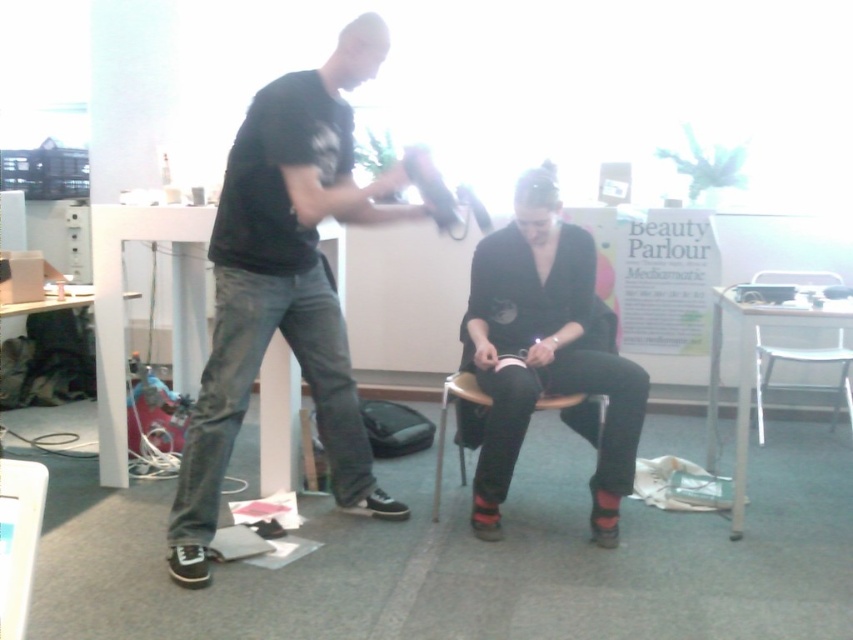
Measure the distance between black matte shirt at center and camera.

The distance of black matte shirt at center from camera is 6.73 feet.

Who is more forward, (419,157) or (440,460)?

Point (419,157) is more forward.

Find the location of a particular element. Image resolution: width=853 pixels, height=640 pixels. black matte shirt at center is located at coordinates (285, 284).

Can you confirm if matte black dress at center is shorter than metallic silver chair at lower right?

No, matte black dress at center is not shorter than metallic silver chair at lower right.

Is point (463, 349) behind point (758, 346)?

That is False.

Consider the image. Who is more forward, (469,362) or (751,282)?

Point (469,362)

Find the location of a particular element. matte black dress at center is located at coordinates coord(543,352).

Between metallic silver chair at lower right and wooden chair at center, which one has less height?

wooden chair at center is shorter.

Does point (788, 300) lie in front of point (490, 403)?

No, (788, 300) is further to viewer.

You are a GUI agent. You are given a task and a screenshot of the screen. Output one action in this format:
    pyautogui.click(x=<x>, y=<y>)
    Task: Click on the metallic silver chair at lower right
    
    Given the screenshot: What is the action you would take?
    pyautogui.click(x=801, y=362)